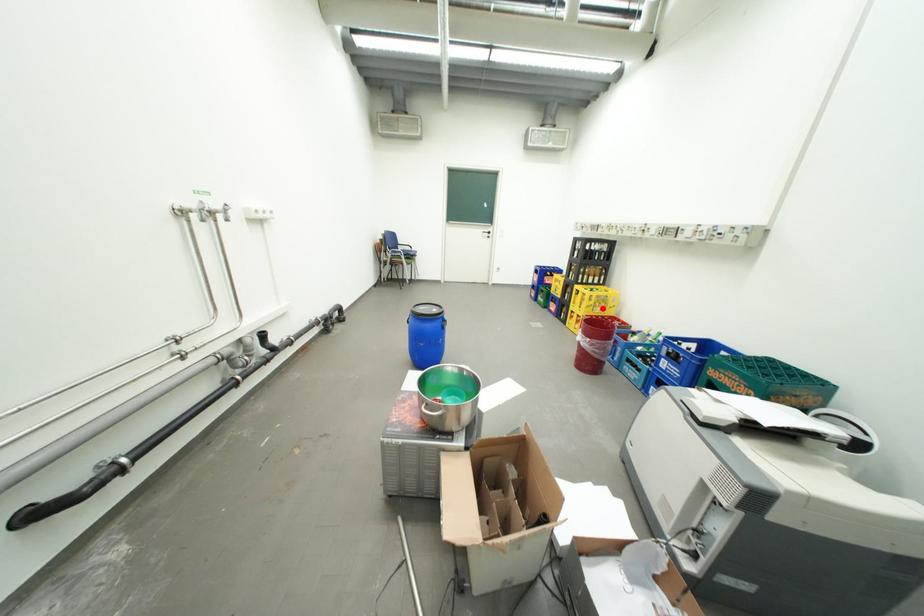
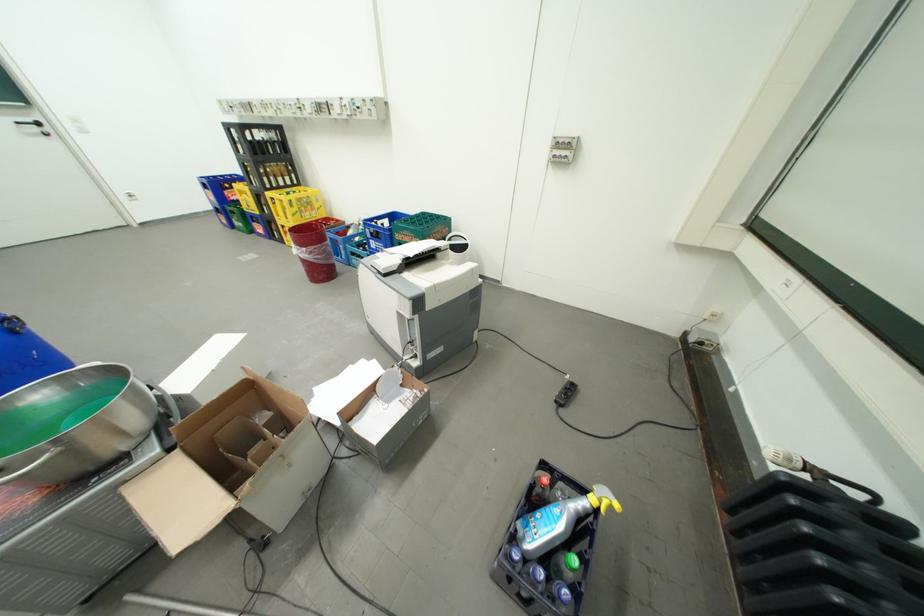
The point at the highlighted location is marked in the first image. Where is the corresponding point in the second image?

(310, 215)